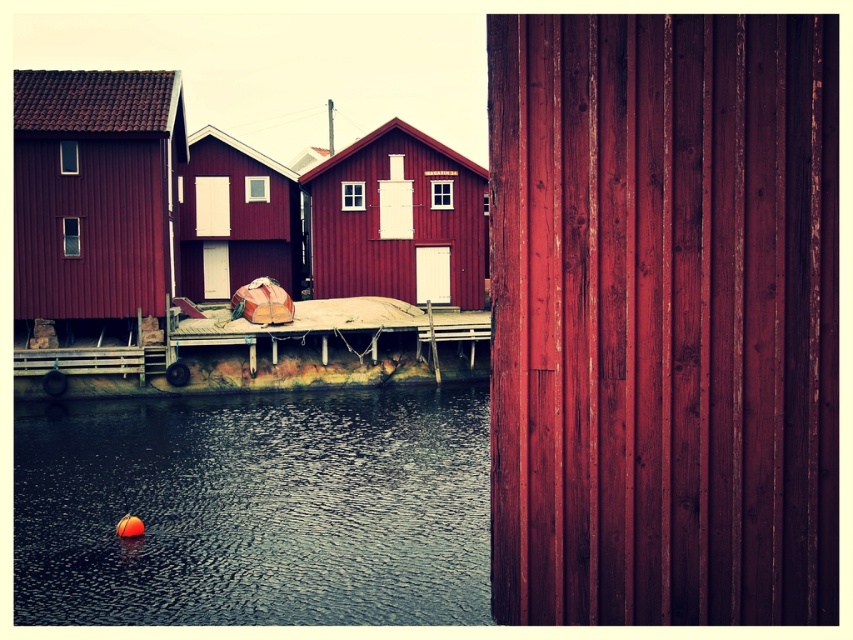
Is point (74, 275) in front of point (283, 333)?

No, it is behind (283, 333).

Between matte wood hut at left and wooden dock at center, which one has less height?

Standing shorter between the two is wooden dock at center.

Is point (144, 268) positioned before point (457, 317)?

Yes, it is.

Locate an element on the screen. The height and width of the screenshot is (640, 853). matte wood hut at left is located at coordinates (96, 193).

Is smooth dark water at lower left to the right of matte wood hut at center from the viewer's perspective?

No, smooth dark water at lower left is not to the right of matte wood hut at center.

Does point (306, 496) come in front of point (433, 230)?

Yes, point (306, 496) is closer to viewer.

At what (x,y) coordinates should I click in order to perform the action: click on smooth dark water at lower left. Please return your answer as a coordinate pair (x, y). Looking at the image, I should click on (254, 509).

This screenshot has width=853, height=640. What are the coordinates of `matte wood hut at left` in the screenshot? It's located at (96, 193).

Is point (134, 186) positioned behind point (218, 276)?

No, (134, 186) is closer to viewer.

At what (x,y) coordinates should I click in order to perform the action: click on matte wood hut at left. Please return your answer as a coordinate pair (x, y). This screenshot has width=853, height=640. Looking at the image, I should click on (96, 193).